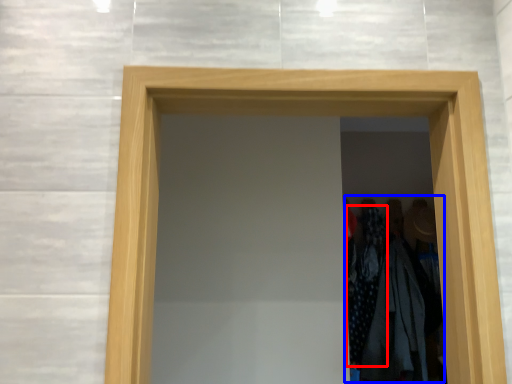
Question: Which object is further to the camera taking this photo, clothing (highlighted by a red box) or laundry (highlighted by a blue box)?

Choices:
 (A) clothing
 (B) laundry

Answer: (A)